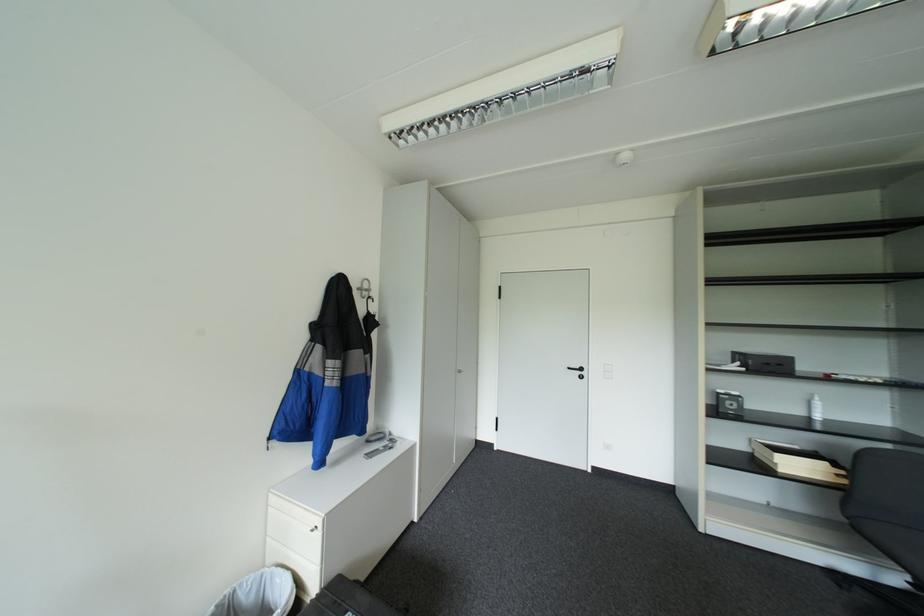
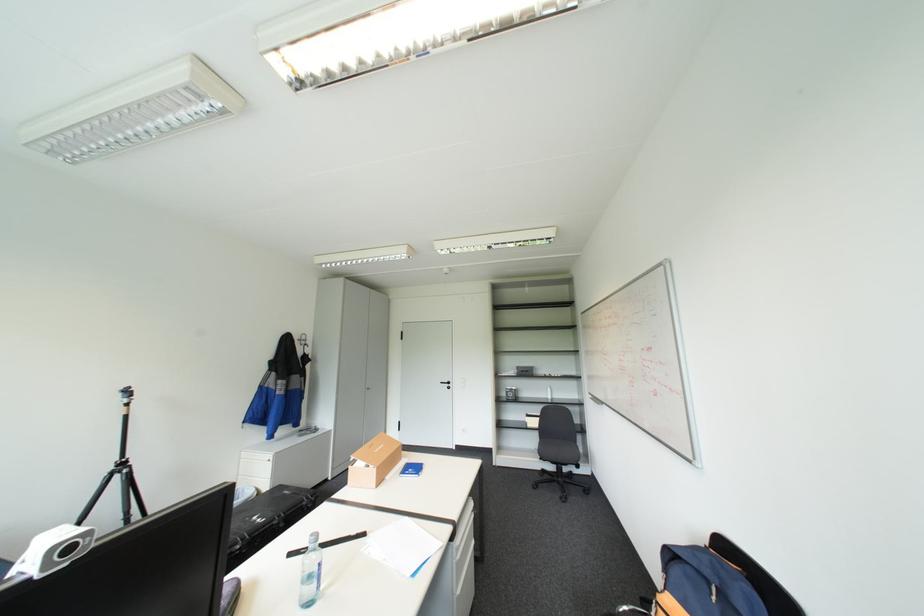
Where in the second image is the point corresponding to pixel 578 367 from the first image?

(450, 381)